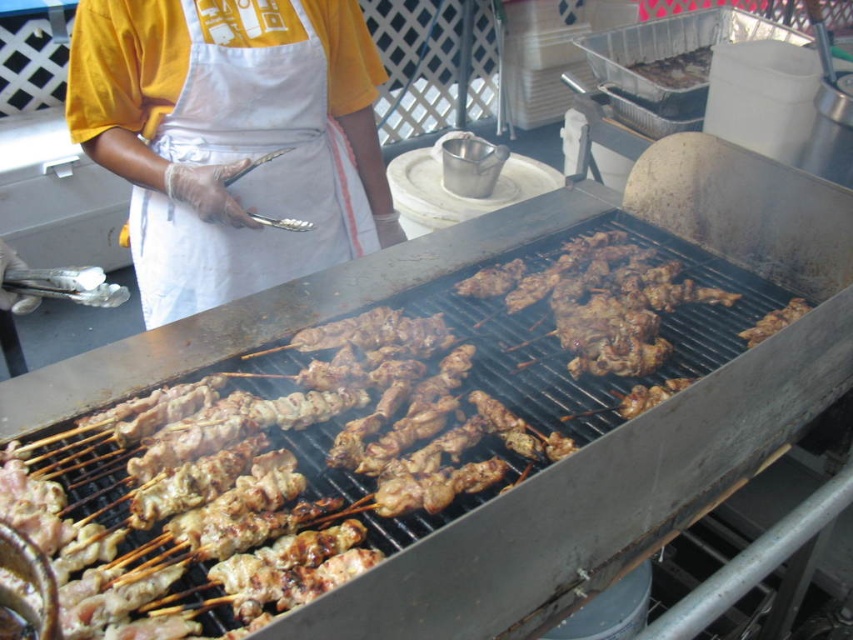
Question: Estimate the real-world distances between objects in this image. Which object is closer to the brown charred skewers at center?

Choices:
 (A) brown charred meat at center
 (B) brown charred chicken skewer at center
 (C) yellow fabric apron at upper center

Answer: (C)

Question: Which of the following is the closest to the observer?

Choices:
 (A) brown charred chicken skewer at center
 (B) brown charred skewers at center
 (C) yellow fabric apron at upper center
 (D) brown charred meat at center

Answer: (B)

Question: Is yellow fabric apron at upper center below brown charred meat at center?

Choices:
 (A) no
 (B) yes

Answer: (B)

Question: Which of the following is the farthest from the observer?

Choices:
 (A) (651, 61)
 (B) (285, 56)

Answer: (A)

Question: Can you confirm if yellow fabric apron at upper center is positioned above brown charred meat at center?

Choices:
 (A) no
 (B) yes

Answer: (A)

Question: Where is brown charred skewers at center located in relation to brown charred chicken skewer at center in the image?

Choices:
 (A) right
 (B) left

Answer: (B)